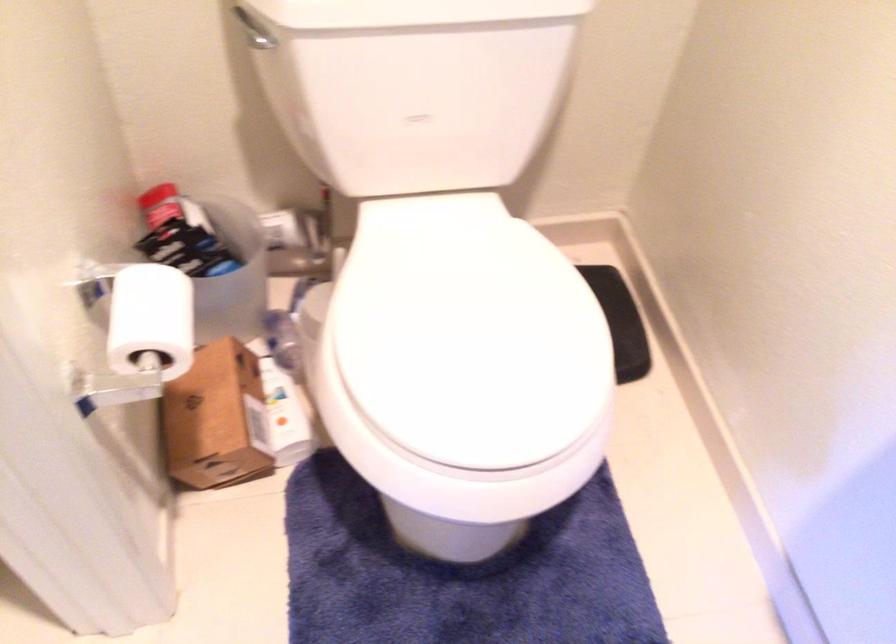
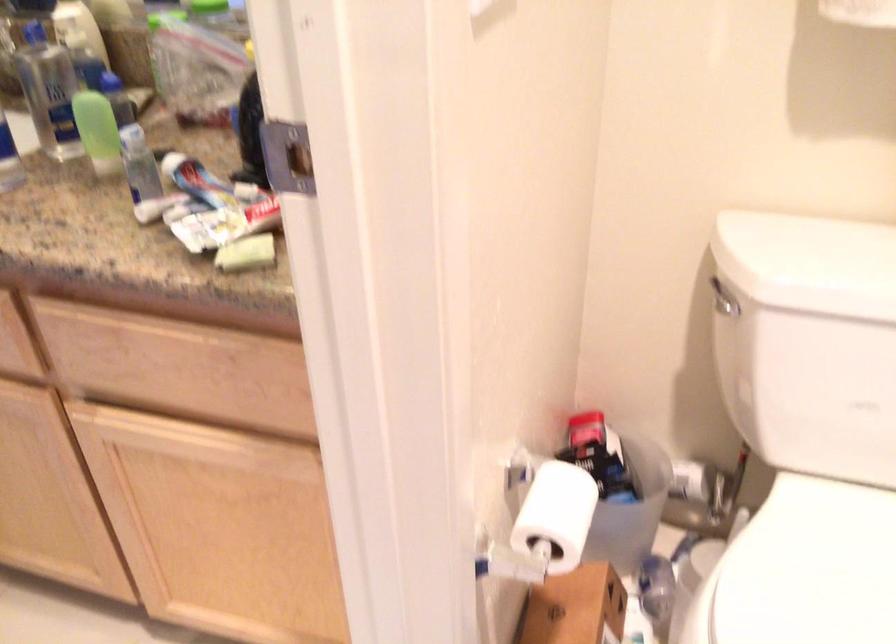
Find the pixel in the second image that matches (x=159, y=323) in the first image.

(556, 515)